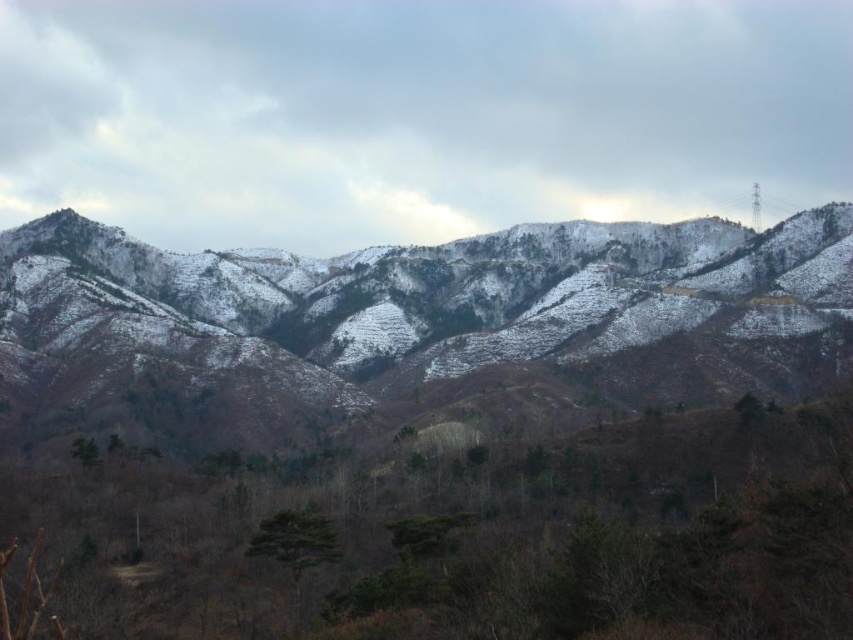
Based on the photo, you are a hiker planning to reach the point marked as point (546, 269) in the mountainous landscape. Given that the average walking speed on such terrain is 2 miles per hour, how many hours will it take you to reach the point from your current position?

The point (546, 269) is 1953.21 feet away from the camera. Converting feet to miles, 1953.21 feet is approximately 0.37 miles. At an average walking speed of 2 miles per hour, it would take roughly 0.185 hours, which is about 11 minutes, to reach the point.